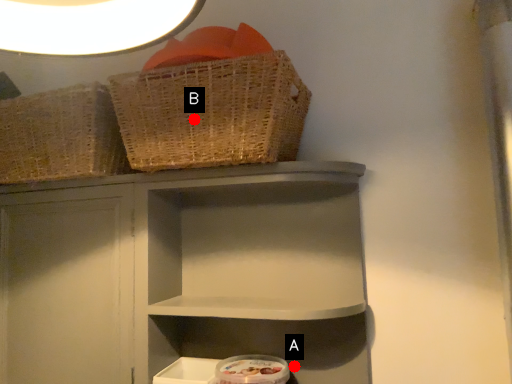
Question: Two points are circled on the image, labeled by A and B beside each circle. Which point is further to the camera?

Choices:
 (A) A is further
 (B) B is further

Answer: (A)